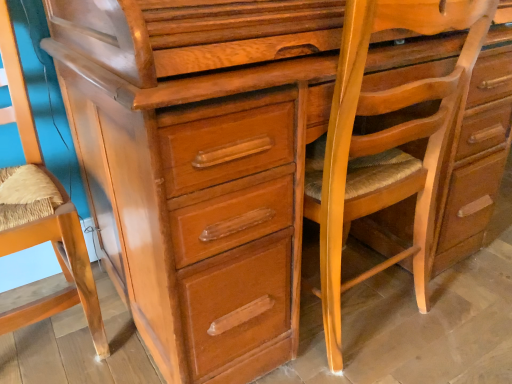
Question: Considering the positions of point (70, 226) and point (454, 109), is point (70, 226) closer or farther from the camera than point (454, 109)?

Choices:
 (A) closer
 (B) farther

Answer: (A)

Question: Considering the positions of wooden textured swivel chair at left and light brown wood rocking chair at center in the image, is wooden textured swivel chair at left taller or shorter than light brown wood rocking chair at center?

Choices:
 (A) short
 (B) tall

Answer: (B)

Question: Do you think wooden textured swivel chair at left is within light brown wood rocking chair at center, or outside of it?

Choices:
 (A) inside
 (B) outside

Answer: (B)

Question: In terms of height, does light brown wood rocking chair at center look taller or shorter compared to wooden textured swivel chair at left?

Choices:
 (A) short
 (B) tall

Answer: (A)

Question: In terms of width, does light brown wood rocking chair at center look wider or thinner when compared to wooden textured swivel chair at left?

Choices:
 (A) wide
 (B) thin

Answer: (B)

Question: From a real-world perspective, relative to wooden textured swivel chair at left, is light brown wood rocking chair at center vertically above or below?

Choices:
 (A) below
 (B) above

Answer: (B)

Question: Choose the correct answer: Is light brown wood rocking chair at center inside wooden textured swivel chair at left or outside it?

Choices:
 (A) outside
 (B) inside

Answer: (A)